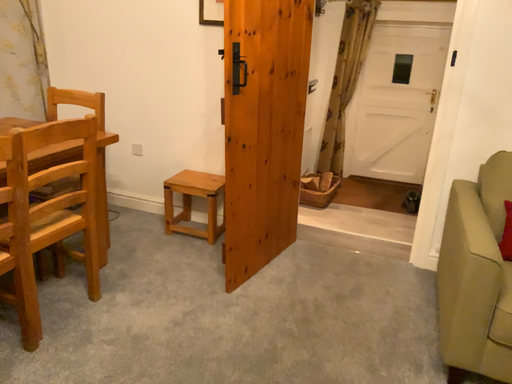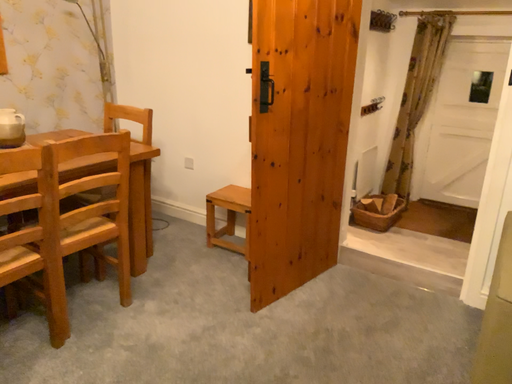
Question: Which way did the camera rotate in the video?

Choices:
 (A) rotated left
 (B) rotated right

Answer: (A)